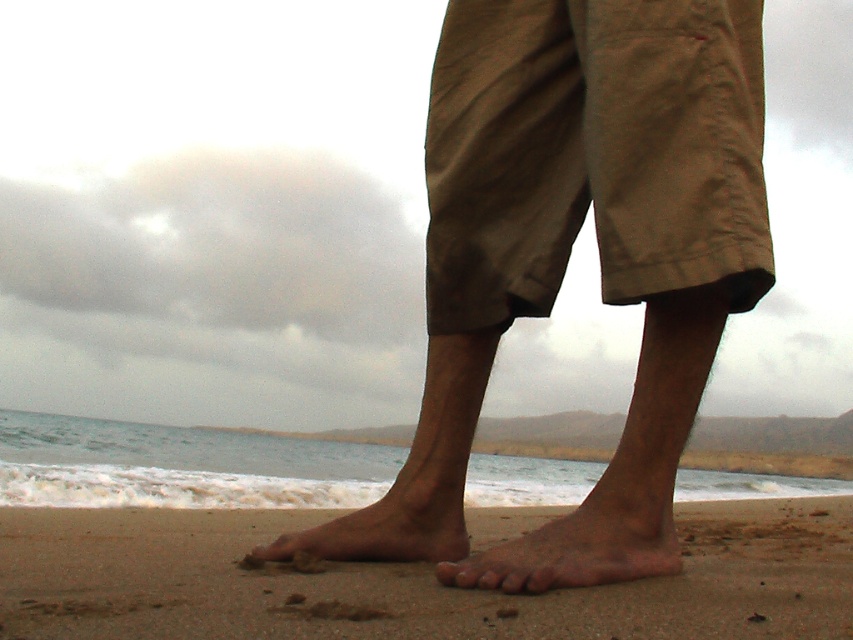
Question: Which of the following is the closest to the observer?

Choices:
 (A) (496, 29)
 (B) (213, 509)
 (C) (643, 520)

Answer: (C)

Question: Does brown cotton shorts at center have a greater width compared to khaki cotton shorts at center?

Choices:
 (A) no
 (B) yes

Answer: (B)

Question: Estimate the real-world distances between objects in this image. Which object is farther from the khaki cotton shorts at center?

Choices:
 (A) brown cotton shorts at center
 (B) brown matte skin at lower center

Answer: (B)

Question: Does brown cotton shorts at center appear under brown matte skin at lower center?

Choices:
 (A) no
 (B) yes

Answer: (A)

Question: In this image, where is khaki cotton shorts at center located relative to brown sand at lower center?

Choices:
 (A) below
 (B) above

Answer: (B)

Question: Which point is farther to the camera?

Choices:
 (A) (213, 572)
 (B) (624, 189)

Answer: (A)